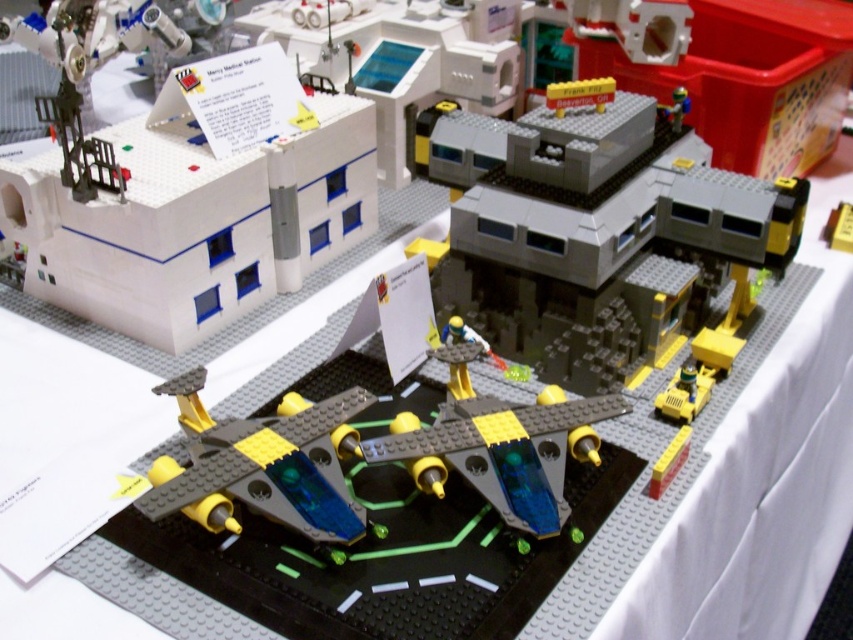
Who is lower down, gray plastic building at center or white plastic building at upper left?

gray plastic building at center

How distant is gray plastic building at center from white plastic building at upper left?

A distance of 15.12 inches exists between gray plastic building at center and white plastic building at upper left.

At what (x,y) coordinates should I click in order to perform the action: click on gray plastic building at center. Please return your answer as a coordinate pair (x, y). The width and height of the screenshot is (853, 640). Looking at the image, I should click on (596, 232).

Who is more distant from viewer, (556, 182) or (326, 536)?

Point (556, 182)

You are a GUI agent. You are given a task and a screenshot of the screen. Output one action in this format:
    pyautogui.click(x=<x>, y=<y>)
    Task: Click on the gray plastic building at center
    
    Given the screenshot: What is the action you would take?
    pyautogui.click(x=596, y=232)

Consider the image. Between gray plastic building at center and metallic silver robot at upper right, which one appears on the left side from the viewer's perspective?

gray plastic building at center

Is point (766, 224) positioned behind point (666, 115)?

No, (766, 224) is in front of (666, 115).

This screenshot has height=640, width=853. I want to click on gray plastic building at center, so click(x=596, y=232).